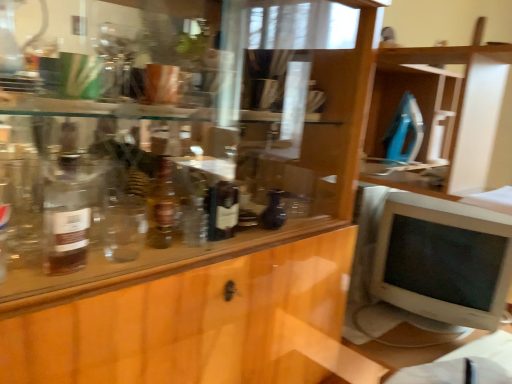
Question: Based on their sizes in the image, would you say translucent glass bottle at left, which is counted as the second bottle, starting from the back, is bigger or smaller than white plastic monitor at right?

Choices:
 (A) big
 (B) small

Answer: (B)

Question: Is translucent glass bottle at left, the 1th bottle when ordered from left to right, to the left or to the right of white plastic monitor at right in the image?

Choices:
 (A) left
 (B) right

Answer: (A)

Question: Estimate the real-world distances between objects in this image. Which object is farther from the white glossy table at lower right?

Choices:
 (A) matte black vase at center, the second bottle positioned from the front
 (B) white plastic monitor at right
 (C) translucent glass bottle at left, the 1th bottle when ordered from left to right

Answer: (C)

Question: Considering the real-world distances, which object is farthest from the white plastic monitor at right?

Choices:
 (A) white glossy table at lower right
 (B) matte black vase at center, acting as the 1th bottle starting from the right
 (C) translucent glass bottle at left, which is counted as the second bottle, starting from the back

Answer: (C)